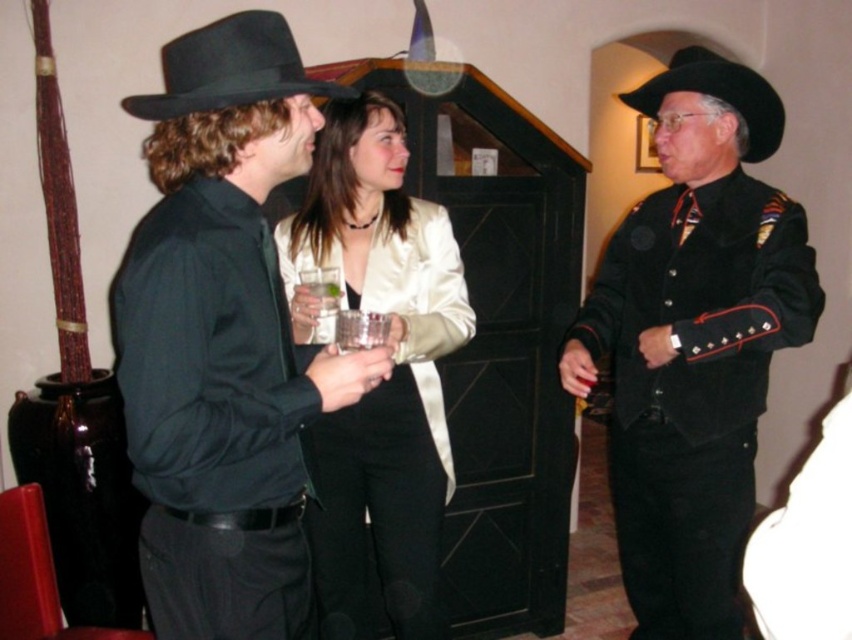
Question: Which object is closer to the camera taking this photo?

Choices:
 (A) black felt fedora at right
 (B) matte black fedora at left

Answer: (B)

Question: Does matte black fedora at left have a smaller size compared to black suede cowboy hat at upper right?

Choices:
 (A) yes
 (B) no

Answer: (A)

Question: In this image, where is matte black fedora at left located relative to satin white jacket at center?

Choices:
 (A) above
 (B) below

Answer: (A)

Question: Among these points, which one is nearest to the camera?

Choices:
 (A) (340, 548)
 (B) (174, 280)

Answer: (B)

Question: Does black felt fedora at left have a lesser width compared to clear glass at center?

Choices:
 (A) yes
 (B) no

Answer: (B)

Question: Considering the real-world distances, which object is farthest from the matte black fedora at left?

Choices:
 (A) clear glass at center
 (B) black felt fedora at left

Answer: (A)